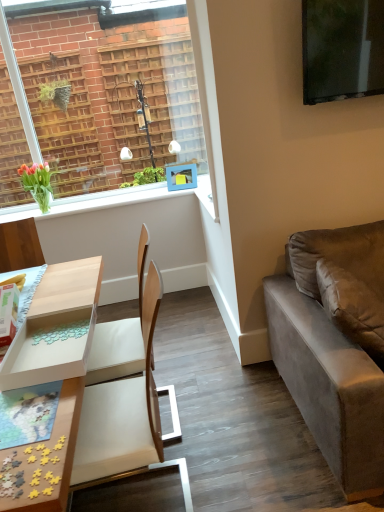
Image resolution: width=384 pixels, height=512 pixels. I want to click on vacant space underneath green matte vase at upper left (from a real-world perspective), so click(55, 208).